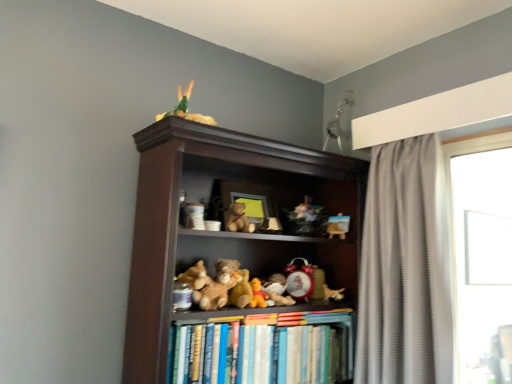
Question: Would you say matte white ceramic cup at center, placed as the tenth toy when sorted from right to left, contains transparent glass window at right?

Choices:
 (A) yes
 (B) no

Answer: (B)

Question: Does matte white ceramic cup at center, placed as the tenth toy when sorted from right to left, have a greater height compared to transparent glass window at right?

Choices:
 (A) yes
 (B) no

Answer: (B)

Question: From a real-world perspective, is matte white ceramic cup at center, placed as the tenth toy when sorted from right to left, on top of transparent glass window at right?

Choices:
 (A) no
 (B) yes

Answer: (B)

Question: Considering the relative sizes of matte white ceramic cup at center, acting as the 1th toy starting from the left, and transparent glass window at right in the image provided, is matte white ceramic cup at center, acting as the 1th toy starting from the left, smaller than transparent glass window at right?

Choices:
 (A) yes
 (B) no

Answer: (A)

Question: Considering the relative positions of matte white ceramic cup at center, placed as the tenth toy when sorted from right to left, and transparent glass window at right in the image provided, is matte white ceramic cup at center, placed as the tenth toy when sorted from right to left, in front of transparent glass window at right?

Choices:
 (A) yes
 (B) no

Answer: (A)

Question: Is soft plush bear at center, which is the 5th toy in right-to-left order, in front of or behind matte white ceramic cup at center, acting as the 1th toy starting from the left, in the image?

Choices:
 (A) behind
 (B) front

Answer: (A)

Question: From a real-world perspective, is soft plush bear at center, which is the 5th toy in right-to-left order, above or below matte white ceramic cup at center, acting as the 1th toy starting from the left?

Choices:
 (A) above
 (B) below

Answer: (B)

Question: Is soft plush bear at center, which is the 6th toy from left to right, wider or thinner than matte white ceramic cup at center, acting as the 1th toy starting from the left?

Choices:
 (A) thin
 (B) wide

Answer: (B)

Question: Is soft plush bear at center, which is the 5th toy in right-to-left order, bigger or smaller than matte white ceramic cup at center, acting as the 1th toy starting from the left?

Choices:
 (A) big
 (B) small

Answer: (A)

Question: Does point (257, 286) appear closer or farther from the camera than point (204, 155)?

Choices:
 (A) farther
 (B) closer

Answer: (A)

Question: From the image's perspective, is brown plush bear at center, which ranks as the seventh toy in right-to-left order, located above or below brown wooden bookcase at center?

Choices:
 (A) below
 (B) above

Answer: (A)

Question: From a real-world perspective, relative to brown wooden bookcase at center, is brown plush bear at center, which is the fourth toy in left-to-right order, vertically above or below?

Choices:
 (A) above
 (B) below

Answer: (B)

Question: Considering the positions of brown plush bear at center, which ranks as the seventh toy in right-to-left order, and brown wooden bookcase at center in the image, is brown plush bear at center, which ranks as the seventh toy in right-to-left order, wider or thinner than brown wooden bookcase at center?

Choices:
 (A) wide
 (B) thin

Answer: (B)

Question: Is gray textured curtain at right taller or shorter than brown wooden bookcase at center?

Choices:
 (A) short
 (B) tall

Answer: (A)

Question: Relative to brown wooden bookcase at center, is gray textured curtain at right in front or behind?

Choices:
 (A) behind
 (B) front

Answer: (A)